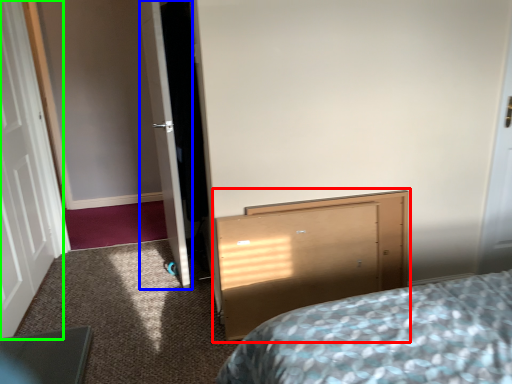
Question: Which is farther away from vanity (highlighted by a red box)? door (highlighted by a blue box) or door (highlighted by a green box)?

Choices:
 (A) door
 (B) door

Answer: (B)